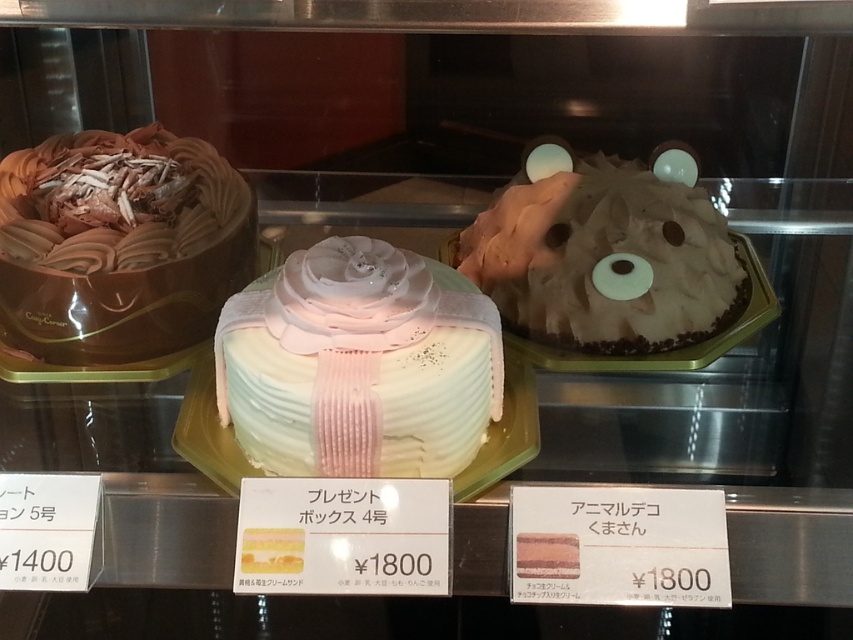
Question: Which object is positioned closest to the chocolate frosted cake at left?

Choices:
 (A) white glossy cake at center
 (B) white matte bear-shaped cake at upper right

Answer: (A)

Question: Which point appears farthest from the camera in this image?

Choices:
 (A) (527, 179)
 (B) (242, 296)
 (C) (140, 280)

Answer: (A)

Question: Considering the relative positions of white glossy cake at center and white matte bear-shaped cake at upper right in the image provided, where is white glossy cake at center located with respect to white matte bear-shaped cake at upper right?

Choices:
 (A) left
 (B) right

Answer: (A)

Question: Estimate the real-world distances between objects in this image. Which object is closer to the chocolate frosted cake at left?

Choices:
 (A) white matte bear-shaped cake at upper right
 (B) white glossy cake at center

Answer: (B)

Question: Does white glossy cake at center appear under white matte bear-shaped cake at upper right?

Choices:
 (A) yes
 (B) no

Answer: (A)

Question: Does chocolate frosted cake at left have a smaller size compared to white matte bear-shaped cake at upper right?

Choices:
 (A) yes
 (B) no

Answer: (B)